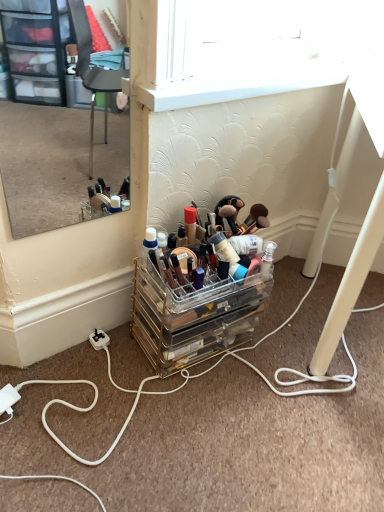
The image size is (384, 512). Find the location of `spots to the right of clear acrylic makeup organizer at center`. spots to the right of clear acrylic makeup organizer at center is located at coordinates (289, 354).